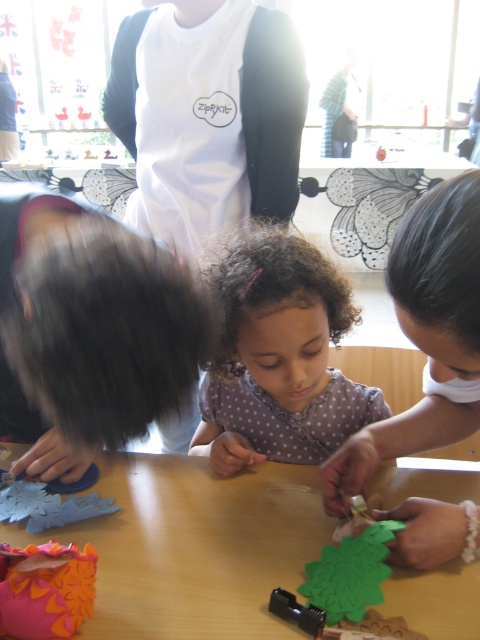
How far apart are dark brown curly hair at left and dark brown smooth hair at upper center?

dark brown curly hair at left and dark brown smooth hair at upper center are 28.47 centimeters apart from each other.

Is point (121, 324) positioned behind point (436, 323)?

That is False.

Where is `dark brown curly hair at left`? dark brown curly hair at left is located at coordinates (101, 336).

Between polka dot fabric at center and dark brown smooth hair at upper center, which one has more height?

Standing taller between the two is polka dot fabric at center.

Can you confirm if polka dot fabric at center is bigger than dark brown smooth hair at upper center?

Indeed, polka dot fabric at center has a larger size compared to dark brown smooth hair at upper center.

Locate an element on the screen. The image size is (480, 640). polka dot fabric at center is located at coordinates (278, 356).

Can you confirm if dark brown curly hair at left is positioned to the left of polka dot fabric at center?

Correct, you'll find dark brown curly hair at left to the left of polka dot fabric at center.

Which is behind, point (172, 291) or point (261, 428)?

The point (261, 428) is behind.

Who is more forward, (24, 419) or (350, 381)?

Point (350, 381) is in front.

What are the coordinates of `dark brown curly hair at left` in the screenshot? It's located at (101, 336).